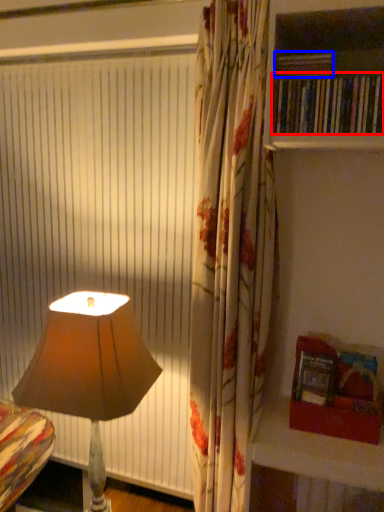
Question: Which object appears closest to the camera in this image, book (highlighted by a red box) or book (highlighted by a blue box)?

Choices:
 (A) book
 (B) book

Answer: (A)